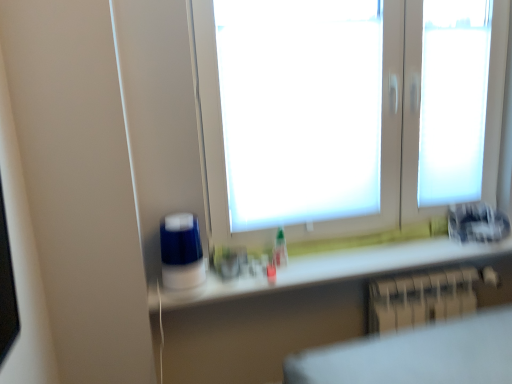
Where is `vacant area on top of white glossy counter top at lower center (from a real-world perspective)`? This screenshot has height=384, width=512. vacant area on top of white glossy counter top at lower center (from a real-world perspective) is located at coordinates (337, 256).